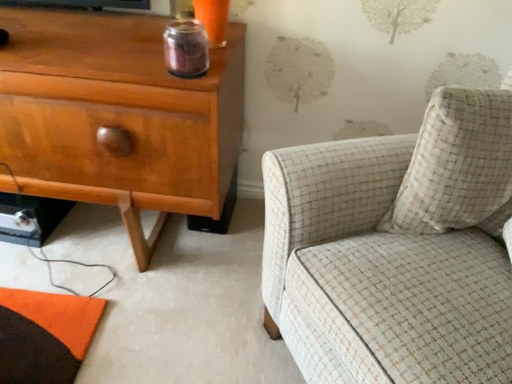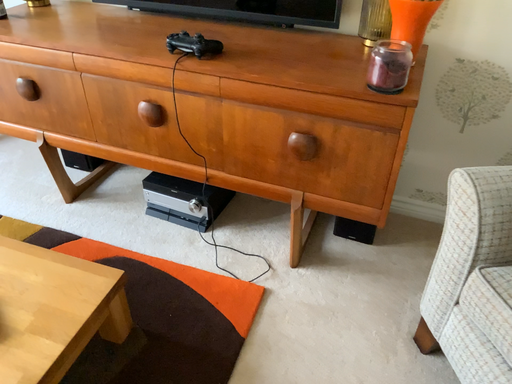
Question: How did the camera likely rotate when shooting the video?

Choices:
 (A) rotated left
 (B) rotated right

Answer: (A)